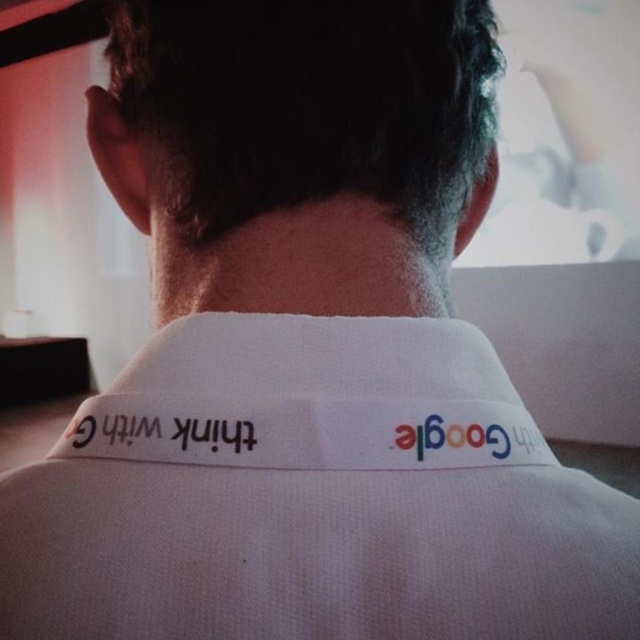
Question: Which point is farther to the camera?

Choices:
 (A) black fabric text at center
 (B) white fabric neckband at center

Answer: (A)

Question: Can you confirm if white fabric neckband at center is thinner than black fabric text at center?

Choices:
 (A) yes
 (B) no

Answer: (B)

Question: Is white fabric neckband at center above black fabric text at center?

Choices:
 (A) no
 (B) yes

Answer: (B)

Question: Among these objects, which one is farthest from the camera?

Choices:
 (A) black fabric text at center
 (B) white fabric neckband at center

Answer: (A)

Question: Is white fabric neckband at center below black fabric text at center?

Choices:
 (A) no
 (B) yes

Answer: (A)